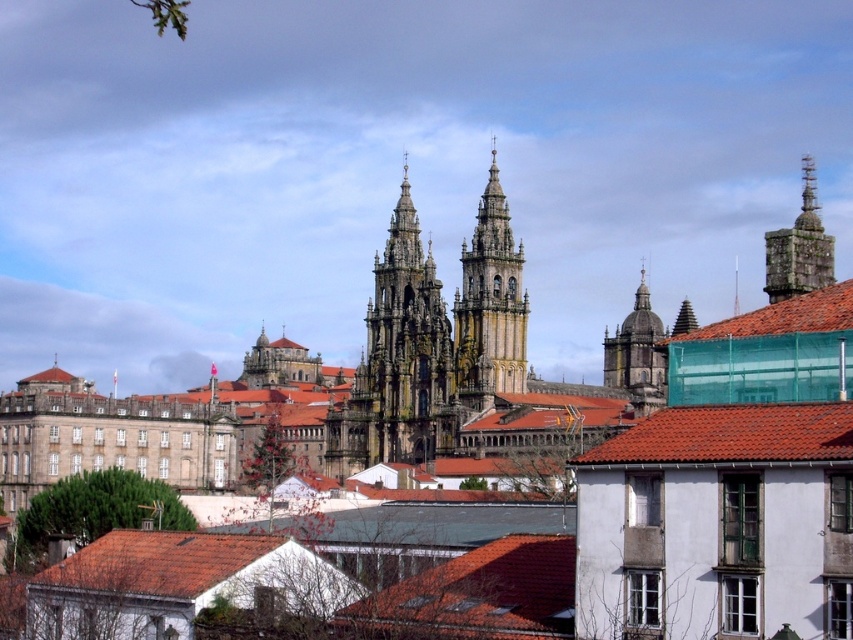
You are standing at point (476, 595) in the cityscape. What can you see directly below you?

At point (476, 595) lies a red tile roof at center.

You are standing in front of the historic cityscape and want to take a photo that includes both the red tile roof at center and the golden stone dome at center. Which object will appear larger in your photo?

The red tile roof at center will appear larger in the photo because it is closer to the viewer than the golden stone dome at center.